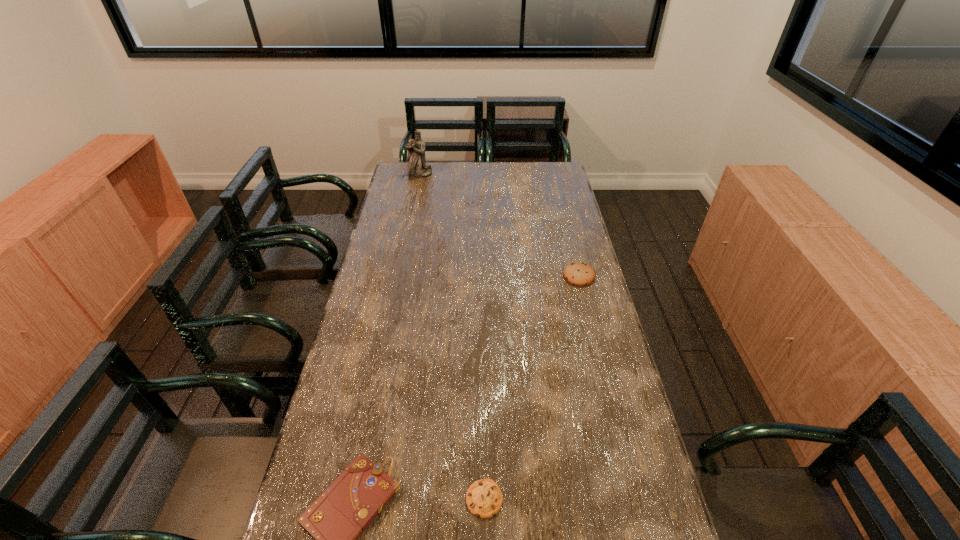
The image size is (960, 540). What are the coordinates of `object at the left edge` in the screenshot? It's located at (417, 167).

Locate an element on the screen. The width and height of the screenshot is (960, 540). object present at the right edge is located at coordinates (579, 274).

Locate an element on the screen. The width and height of the screenshot is (960, 540). object that is at the far left corner is located at coordinates (417, 167).

Where is `vacant area at the far edge`? This screenshot has height=540, width=960. vacant area at the far edge is located at coordinates (444, 167).

Find the location of a particular element. The height and width of the screenshot is (540, 960). free point at the left edge is located at coordinates click(372, 369).

This screenshot has width=960, height=540. In the image, there is a desktop. Find the location of `free space at the right edge`. free space at the right edge is located at coordinates (578, 390).

The image size is (960, 540). In the image, there is a desktop. In order to click on vacant space at the far right corner in this screenshot , I will do `click(546, 184)`.

Locate an element on the screen. free spot between the farthest object and the right cookie is located at coordinates (499, 225).

Find the location of a particular element. vacant area that lies between the figurine and the nearer cookie is located at coordinates (452, 336).

This screenshot has width=960, height=540. Identify the location of vacant area between the farther cookie and the nearer cookie. (532, 387).